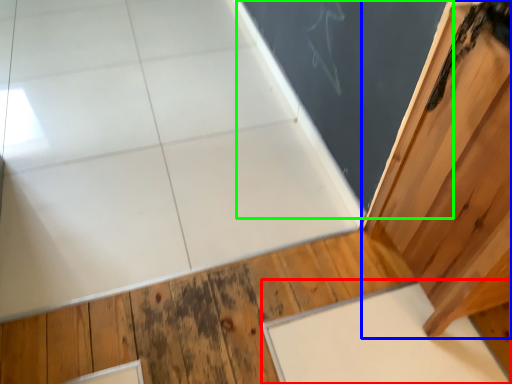
Question: Considering the real-world distances, which object is farthest from slate (highlighted by a red box)? door (highlighted by a blue box) or bulletin board (highlighted by a green box)?

Choices:
 (A) door
 (B) bulletin board

Answer: (B)